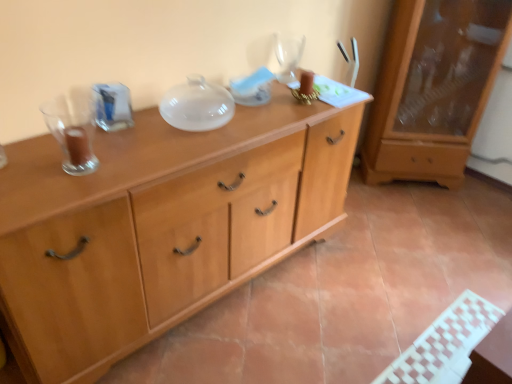
Find the location of a particular element. This screenshot has height=384, width=512. free location in front of matte wooden cabinet at right is located at coordinates (438, 225).